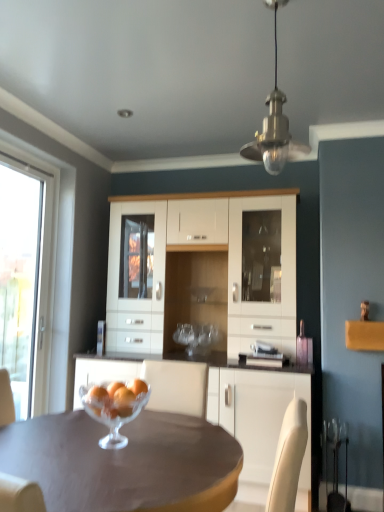
Locate an element on the screen. This screenshot has height=512, width=384. free space above matte brown table at center (from a real-world perspective) is located at coordinates (112, 446).